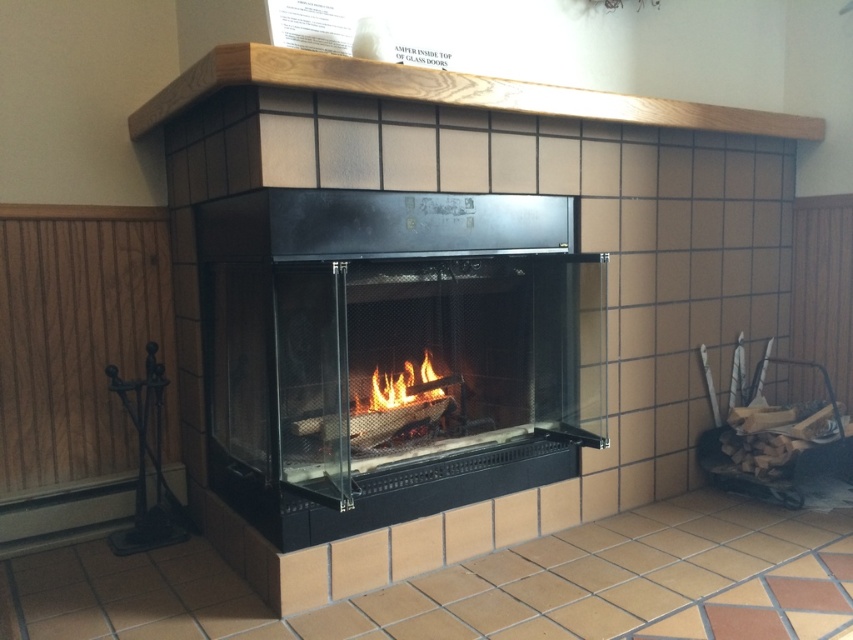
You are standing in front of the fireplace and want to place a small decoration. You have two points marked on the wall where you can place it. The first point is at coordinates point (323, 67) and the second is at point (408, 392). Which point is closer to you?

Point (323, 67) is closer to the viewer than point (408, 392), so you should place the decoration there if you want it nearer to your position.

You are standing in front of the fireplace and want to place a 6 feet long decorative log into the black glass fireplace at center. Can you safely place it without moving closer than your current position?

The black glass fireplace at center is 5.79 feet away from camera. Since the log is 6 feet long, it might be too long to safely place without moving closer, so it is not advisable to attempt placing it from your current position.

You are planning to place a decorative item on the wooden mantle at upper center and the flamewoodfire at center. Based on their sizes, which object can accommodate a larger decorative item?

The wooden mantle at upper center is bigger than the flamewoodfire at center, so it can accommodate a larger decorative item.